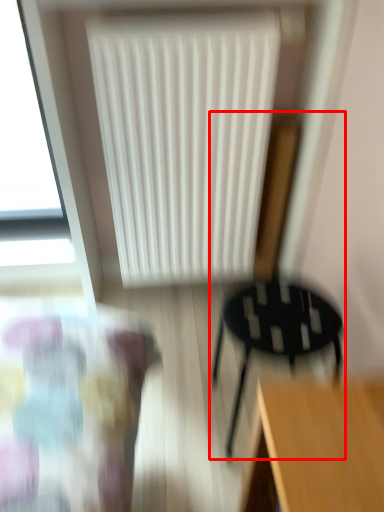
Question: From the image's perspective, where is chair (annotated by the red box) located relative to radiator?

Choices:
 (A) below
 (B) above

Answer: (A)